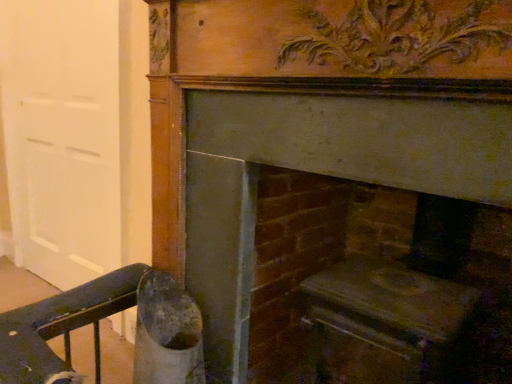
Question: Considering the relative positions of smooth stone hearth at center, positioned as the first fireplace in right-to-left order, and white matte door at left in the image provided, is smooth stone hearth at center, positioned as the first fireplace in right-to-left order, to the left of white matte door at left from the viewer's perspective?

Choices:
 (A) no
 (B) yes

Answer: (A)

Question: Is smooth stone hearth at center, positioned as the first fireplace in right-to-left order, smaller than white matte door at left?

Choices:
 (A) yes
 (B) no

Answer: (B)

Question: From a real-world perspective, is smooth stone hearth at center, positioned as the first fireplace in right-to-left order, physically below white matte door at left?

Choices:
 (A) yes
 (B) no

Answer: (A)

Question: Considering the relative sizes of smooth stone hearth at center, positioned as the first fireplace in right-to-left order, and white matte door at left in the image provided, is smooth stone hearth at center, positioned as the first fireplace in right-to-left order, wider than white matte door at left?

Choices:
 (A) yes
 (B) no

Answer: (A)

Question: Considering the relative positions of smooth stone hearth at center, positioned as the first fireplace in right-to-left order, and white matte door at left in the image provided, is smooth stone hearth at center, positioned as the first fireplace in right-to-left order, to the right of white matte door at left from the viewer's perspective?

Choices:
 (A) no
 (B) yes

Answer: (B)

Question: Does point (471, 342) appear closer or farther from the camera than point (301, 220)?

Choices:
 (A) closer
 (B) farther

Answer: (A)

Question: From a real-world perspective, is wooden fireplace at center, the second fireplace viewed from the right, positioned above or below smooth stone hearth at center, positioned as the first fireplace in right-to-left order?

Choices:
 (A) above
 (B) below

Answer: (A)

Question: Which is correct: wooden fireplace at center, marked as the 1th fireplace in a left-to-right arrangement, is inside smooth stone hearth at center, which is the 2th fireplace in left-to-right order, or outside of it?

Choices:
 (A) outside
 (B) inside

Answer: (A)

Question: In terms of height, does wooden fireplace at center, marked as the 1th fireplace in a left-to-right arrangement, look taller or shorter compared to smooth stone hearth at center, which is the 2th fireplace in left-to-right order?

Choices:
 (A) short
 (B) tall

Answer: (B)

Question: From their relative heights in the image, would you say smooth stone hearth at center, which is the 2th fireplace in left-to-right order, is taller or shorter than white matte door at left?

Choices:
 (A) short
 (B) tall

Answer: (A)

Question: Does point (472, 354) appear closer or farther from the camera than point (78, 249)?

Choices:
 (A) closer
 (B) farther

Answer: (A)

Question: From a real-world perspective, relative to white matte door at left, is smooth stone hearth at center, positioned as the first fireplace in right-to-left order, vertically above or below?

Choices:
 (A) below
 (B) above

Answer: (A)

Question: Looking at their shapes, would you say smooth stone hearth at center, which is the 2th fireplace in left-to-right order, is wider or thinner than white matte door at left?

Choices:
 (A) thin
 (B) wide

Answer: (B)

Question: Is smooth stone hearth at center, positioned as the first fireplace in right-to-left order, spatially inside wooden fireplace at center, marked as the 1th fireplace in a left-to-right arrangement, or outside of it?

Choices:
 (A) inside
 (B) outside

Answer: (B)

Question: Is smooth stone hearth at center, which is the 2th fireplace in left-to-right order, wider or thinner than wooden fireplace at center, marked as the 1th fireplace in a left-to-right arrangement?

Choices:
 (A) wide
 (B) thin

Answer: (A)